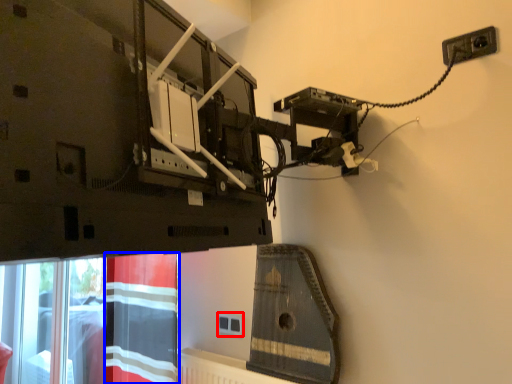
Question: Which object is further to the camera taking this photo, socket (highlighted by a red box) or curtain (highlighted by a blue box)?

Choices:
 (A) socket
 (B) curtain

Answer: (A)